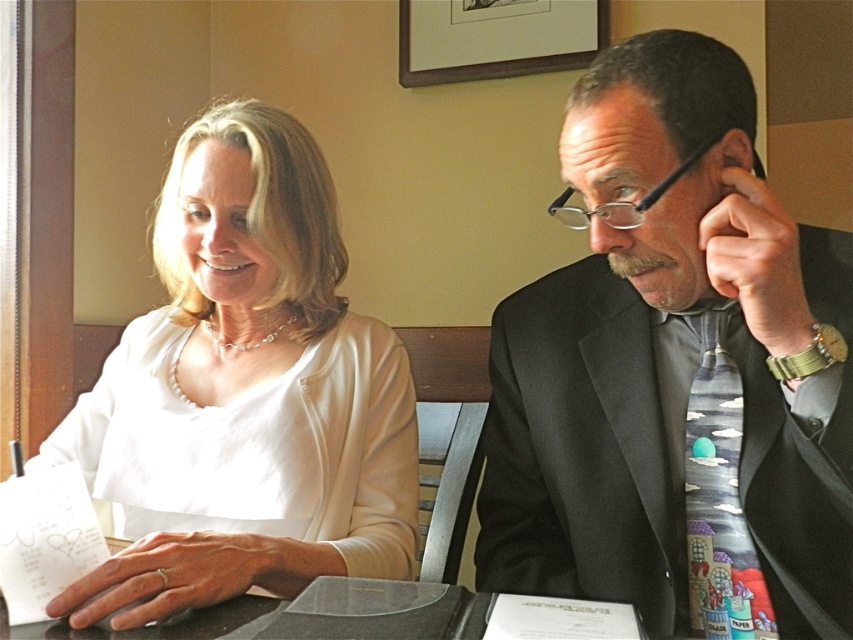
Between point (773, 515) and point (184, 161), which one is positioned behind?

Positioned behind is point (184, 161).

Between matte black suit at right and white matte blouse at upper left, which one has more height?

With more height is matte black suit at right.

Between point (634, 564) and point (190, 401), which one is positioned in front?

Point (634, 564) is more forward.

Locate an element on the screen. The height and width of the screenshot is (640, 853). matte black suit at right is located at coordinates (674, 365).